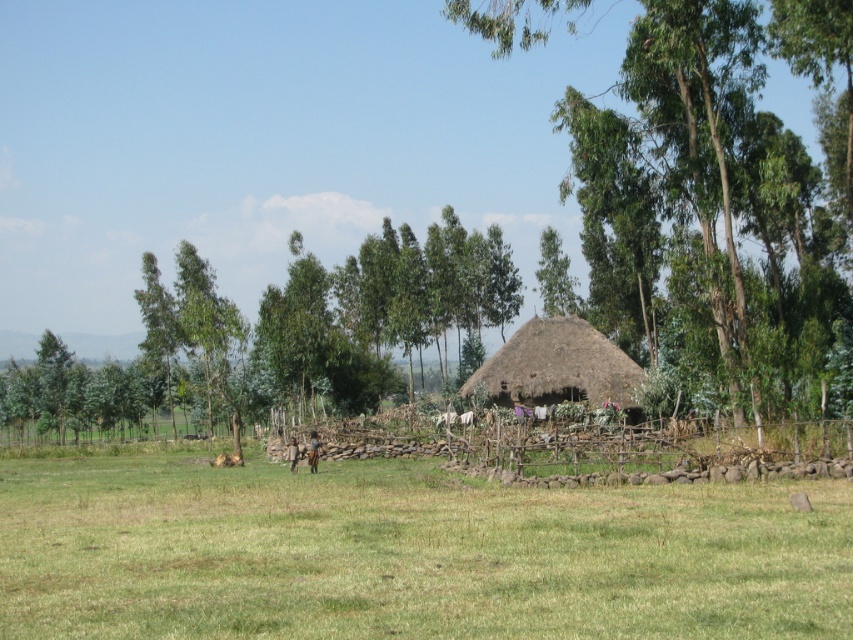
Does green grassy field at center appear on the left side of brown thatch hut at center?

Correct, you'll find green grassy field at center to the left of brown thatch hut at center.

Does green grassy field at center appear under brown thatch hut at center?

Yes, green grassy field at center is below brown thatch hut at center.

Is point (476, 499) in front of point (560, 340)?

Yes, point (476, 499) is closer to viewer.

Where is `green grassy field at center`? The height and width of the screenshot is (640, 853). green grassy field at center is located at coordinates (409, 554).

Does green grassy field at center appear under green leafy tree at center?

Correct, green grassy field at center is located below green leafy tree at center.

Who is more forward, [86,481] or [735,282]?

Point [86,481] is more forward.

Is point (514, 580) behind point (782, 224)?

That is False.

You are a GUI agent. You are given a task and a screenshot of the screen. Output one action in this format:
    pyautogui.click(x=<x>, y=<y>)
    Task: Click on the green grassy field at center
    Image resolution: width=853 pixels, height=640 pixels.
    Given the screenshot: What is the action you would take?
    pyautogui.click(x=409, y=554)

Does green leafy tree at center appear over brown thatch hut at center?

Indeed, green leafy tree at center is positioned over brown thatch hut at center.

Which of these two, green leafy tree at center or brown thatch hut at center, stands shorter?

brown thatch hut at center

From the picture: Who is more distant from viewer, (519, 36) or (630, 368)?

Point (519, 36)

This screenshot has width=853, height=640. I want to click on green leafy tree at center, so click(x=720, y=193).